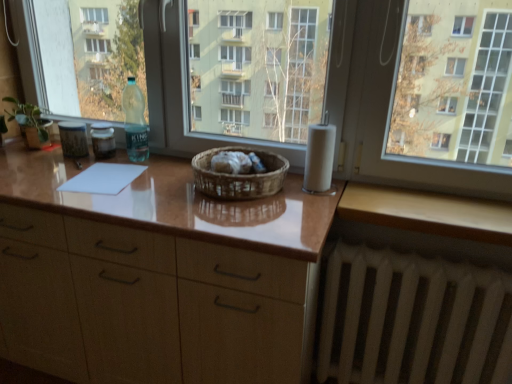
In order to click on blank area beneath green matte plant at left (from a real-world perspective) in this screenshot , I will do `click(23, 150)`.